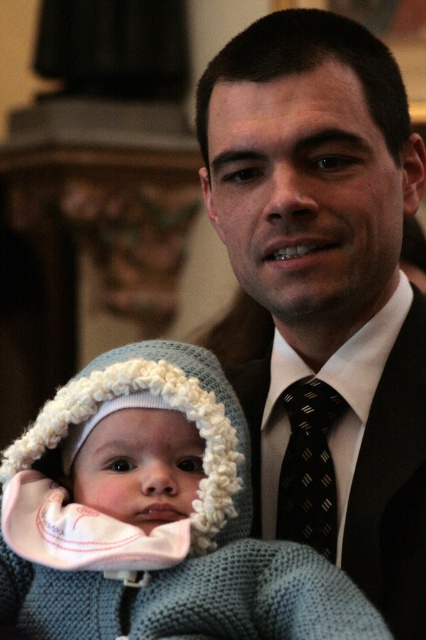
Question: Among these points, which one is farthest from the camera?

Choices:
 (A) (417, 483)
 (B) (339, 630)

Answer: (A)

Question: Can you confirm if knitted blue hat at center is positioned above black dotted tie at center?

Choices:
 (A) no
 (B) yes

Answer: (A)

Question: Which object appears farthest from the camera in this image?

Choices:
 (A) matte black suit at center
 (B) black dotted tie at center

Answer: (B)

Question: Among these objects, which one is nearest to the camera?

Choices:
 (A) knitted blue hat at center
 (B) matte black suit at center
 (C) black silk tie at center

Answer: (A)

Question: Can you confirm if matte black suit at center is positioned to the right of knitted blue hat at center?

Choices:
 (A) no
 (B) yes

Answer: (B)

Question: Is matte black suit at center below knitted blue hat at center?

Choices:
 (A) yes
 (B) no

Answer: (B)